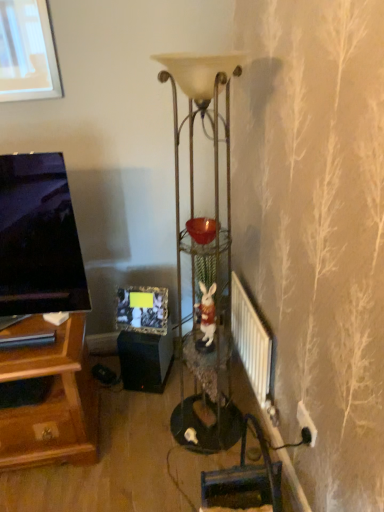
Question: In terms of size, does white metallic radiator at lower right appear bigger or smaller than matte black picture frame at center?

Choices:
 (A) small
 (B) big

Answer: (B)

Question: Which is correct: white metallic radiator at lower right is inside matte black picture frame at center, or outside of it?

Choices:
 (A) outside
 (B) inside

Answer: (A)

Question: Which object is positioned closest to the white metallic radiator at lower right?

Choices:
 (A) white ceramic rabbit at center
 (B) metallic gold floor lamp at center
 (C) black matte speaker at lower center
 (D) matte black picture frame at center
 (E) white plastic electric outlet at lower right

Answer: (A)

Question: Which is nearer to the metallic gold floor lamp at center?

Choices:
 (A) white metallic radiator at lower right
 (B) white ceramic rabbit at center
 (C) matte black picture frame at center
 (D) black matte speaker at lower center
 (E) white plastic electric outlet at lower right

Answer: (B)